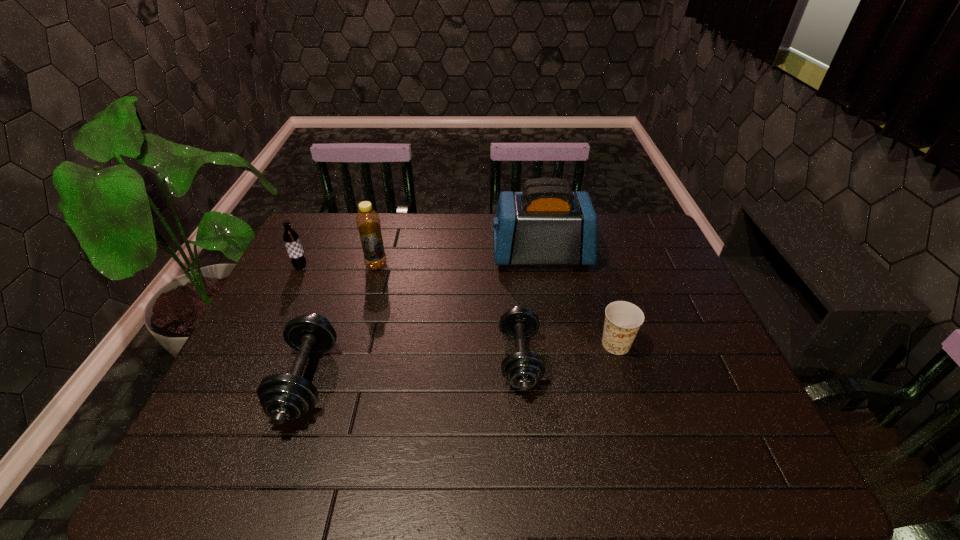
The image size is (960, 540). Identify the location of free location that satisfies the following two spatial constraints: 1. on the back side of the Dixie cup; 2. on the front-facing side of the toaster. (588, 255).